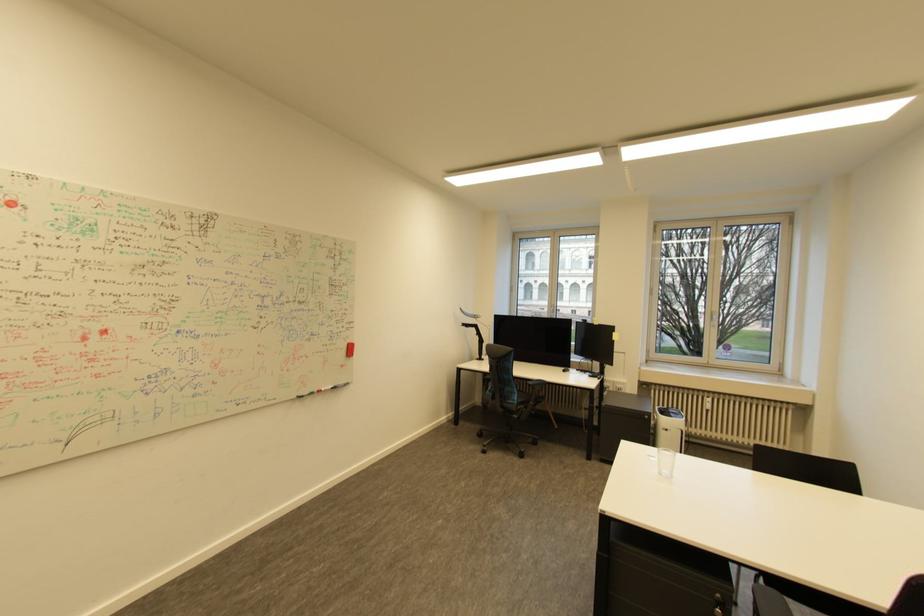
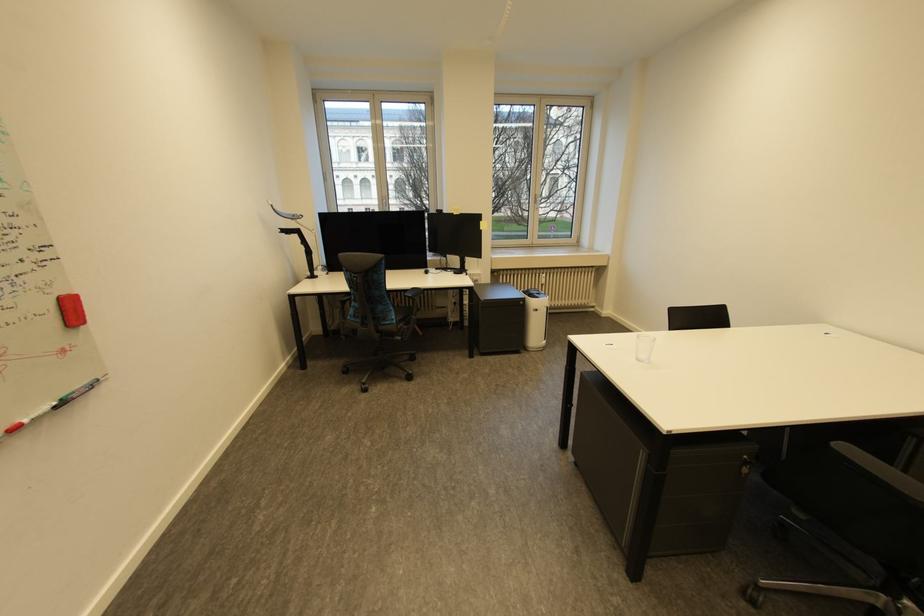
Locate, in the second image, the point that corresponds to [553,315] in the first image.

(383, 209)